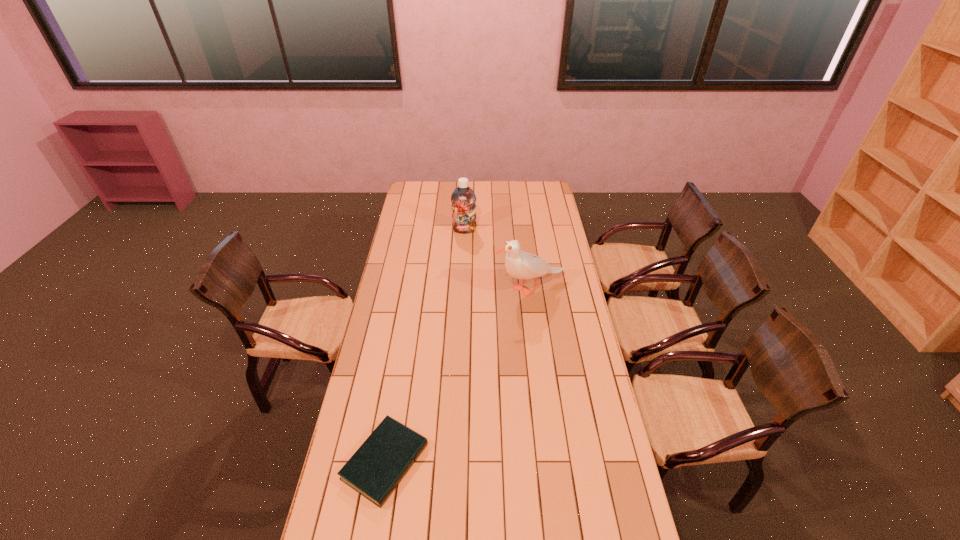
Image resolution: width=960 pixels, height=540 pixels. What are the coordinates of `blank space located 0.200m on the right of the leftmost object` in the screenshot? It's located at (487, 462).

You are a GUI agent. You are given a task and a screenshot of the screen. Output one action in this format:
    pyautogui.click(x=<x>, y=<y>)
    Task: Click on the object present at the left edge
    
    Given the screenshot: What is the action you would take?
    pyautogui.click(x=376, y=468)

What are the coordinates of `object at the right edge` in the screenshot? It's located at (521, 265).

Identify the location of vacant space at the far edge. The width and height of the screenshot is (960, 540). (450, 195).

The height and width of the screenshot is (540, 960). Identify the location of free space at the left edge. (412, 202).

Locate an element on the screen. The width and height of the screenshot is (960, 540). vacant area at the right edge is located at coordinates (540, 247).

This screenshot has width=960, height=540. Identify the location of vacant region at the far right corner of the desktop. 542,198.

Where is `vacant space that's between the second nearest object and the nearest object`? This screenshot has width=960, height=540. vacant space that's between the second nearest object and the nearest object is located at coordinates (458, 375).

You are a GUI agent. You are given a task and a screenshot of the screen. Output one action in this format:
    pyautogui.click(x=<x>, y=<y>)
    Task: Click on the blank region between the second nearest object and the shortest object
    
    Given the screenshot: What is the action you would take?
    pyautogui.click(x=458, y=375)

Where is `free space between the shampoo and the second farthest object`? free space between the shampoo and the second farthest object is located at coordinates (497, 260).